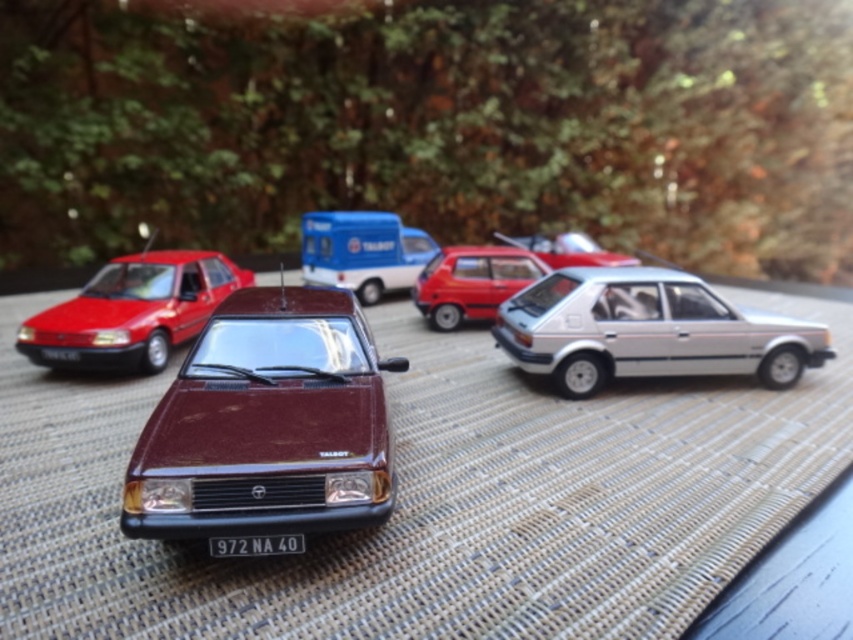
Question: Estimate the real-world distances between objects in this image. Which object is closer to the maroon metallic hatchback at center?

Choices:
 (A) blue metallic van at center
 (B) matte red hatchback at center
 (C) metallic red hatchback at center
 (D) matte red car at left

Answer: (D)

Question: Which point is farther to the camera?

Choices:
 (A) matte red car at left
 (B) blue metallic van at center

Answer: (B)

Question: Which object is the closest to the maroon metallic hatchback at center?

Choices:
 (A) matte red car at left
 (B) blue metallic van at center
 (C) matte red hatchback at center

Answer: (A)

Question: Is matte red hatchback at center to the right of black plastic license plate at center from the viewer's perspective?

Choices:
 (A) no
 (B) yes

Answer: (B)

Question: From the image, what is the correct spatial relationship of silver metallic hatchback at right in relation to metallic red hatchback at center?

Choices:
 (A) below
 (B) above

Answer: (A)

Question: Is matte red car at left further to camera compared to blue metallic van at center?

Choices:
 (A) no
 (B) yes

Answer: (A)